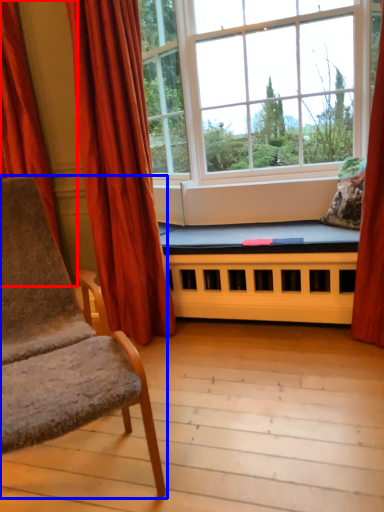
Question: Which point is further to the camera, curtain (highlighted by a red box) or chair (highlighted by a blue box)?

Choices:
 (A) curtain
 (B) chair

Answer: (A)